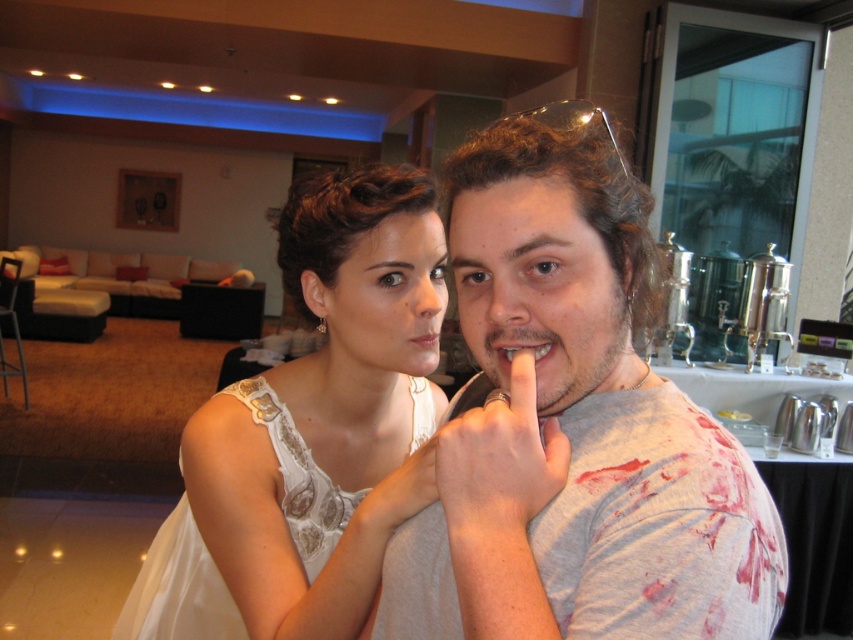
Between white lace dress at center and white matte finger at center, which one appears on the left side from the viewer's perspective?

From the viewer's perspective, white lace dress at center appears more on the left side.

Who is more forward, (263,481) or (495,506)?

Point (495,506) is more forward.

Where is `white lace dress at center`? white lace dress at center is located at coordinates click(x=311, y=432).

Between gray cotton t-shirt at center and white lace dress at center, which one appears on the right side from the viewer's perspective?

From the viewer's perspective, gray cotton t-shirt at center appears more on the right side.

Does gray cotton t-shirt at center appear on the right side of white lace dress at center?

Yes, gray cotton t-shirt at center is to the right of white lace dress at center.

Looking at this image, who is more distant from viewer, (482, 291) or (392, 358)?

The point (392, 358) is behind.

This screenshot has height=640, width=853. What are the coordinates of `gray cotton t-shirt at center` in the screenshot? It's located at (573, 428).

Can you confirm if white lace dress at center is taller than matte white teeth at center?

Yes, white lace dress at center is taller than matte white teeth at center.

Which is more to the left, white lace dress at center or matte white teeth at center?

white lace dress at center

Is point (405, 440) more distant than point (532, 348)?

Yes, point (405, 440) is farther from viewer.

At what (x,y) coordinates should I click in order to perform the action: click on white lace dress at center. Please return your answer as a coordinate pair (x, y). The width and height of the screenshot is (853, 640). Looking at the image, I should click on (311, 432).